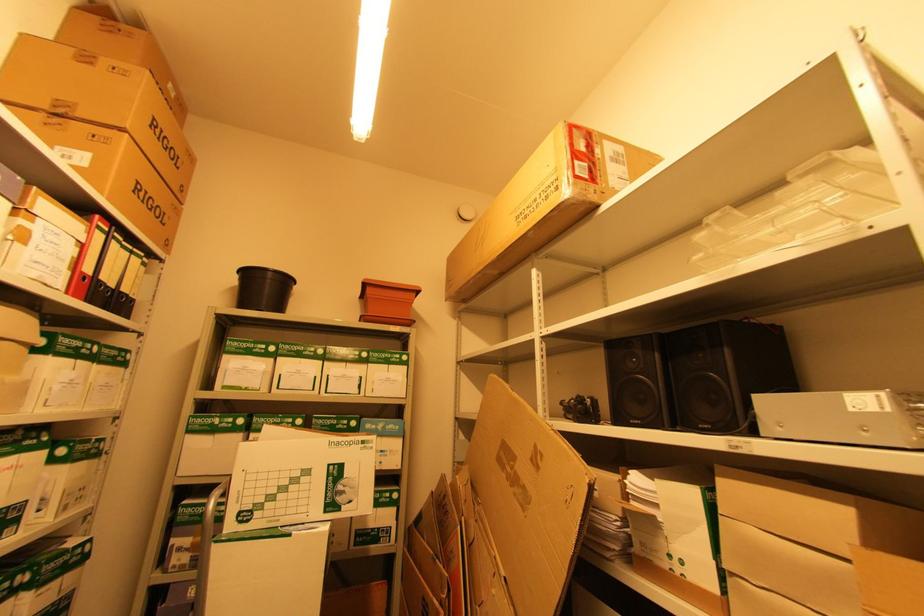
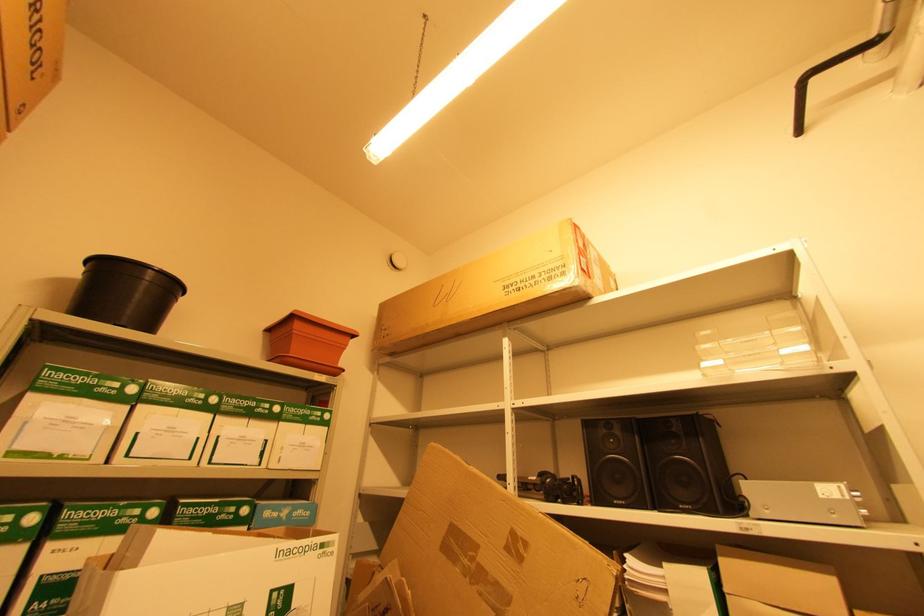
Question: Based on the continuous images, in which direction is the camera rotating? Reply with the corresponding letter.

Choices:
 (A) Left
 (B) Right
 (C) Up
 (D) Down

Answer: (B)